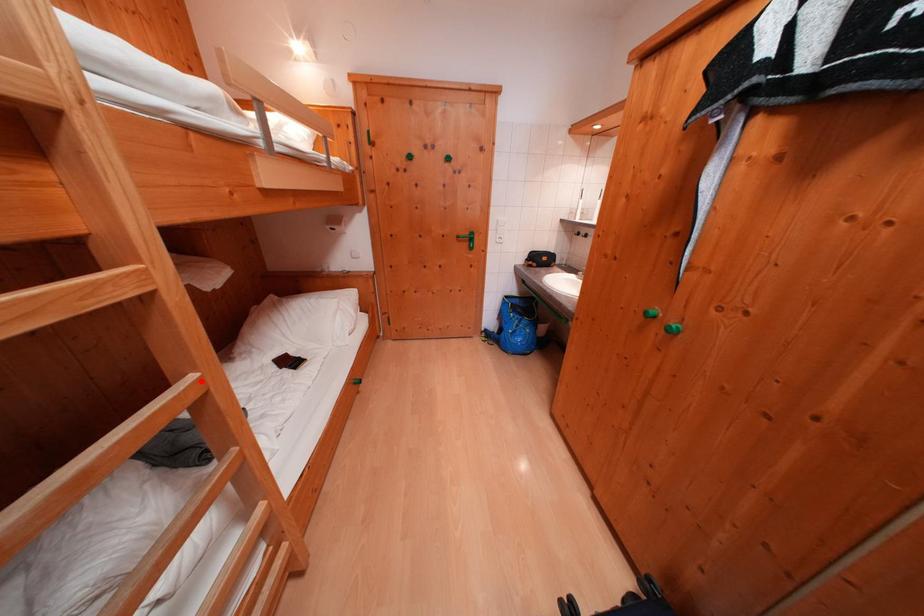
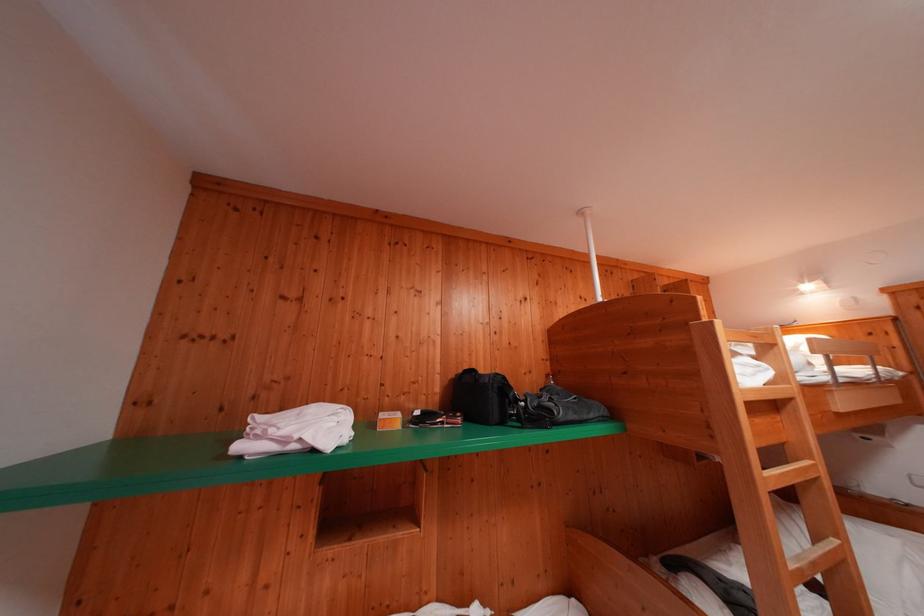
The point at the highlighted location is marked in the first image. Where is the corresponding point in the second image?

(843, 545)